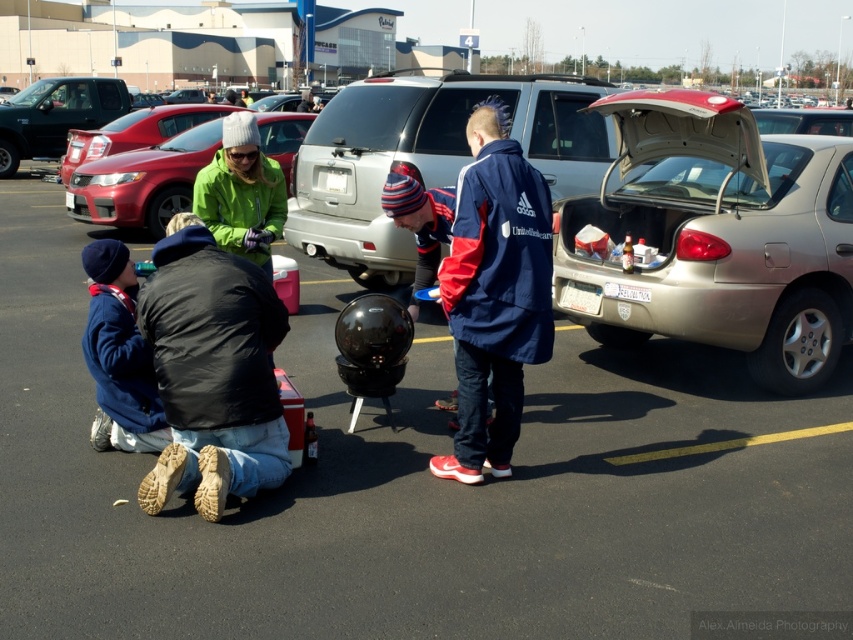
You are a photographer trying to capture a candid shot of the two people sitting by the barbecue grill. You want to ensure that both the matte blue jacket at lower left and the green fleece jacket at upper center are visible in the frame. Given their positions and sizes, will you need to adjust your camera angle to include both?

The matte blue jacket at lower left is taller than the green fleece jacket at upper center. To include both in the frame, you may need to adjust your camera angle to account for the height difference between the two jackets.

You are standing at the point labeled as point (300, 102) and want to walk towards the point labeled as point (537, 337). Which direction should you face to move towards your destination?

You should face forward because point (537, 337) is in front of point (300, 102).

You are driving a car and need to park in the parking lot shown. There is a gold metallic sedan at center right and a navy blue fabric jacket at center. Which object is closer to the parking spot you want to enter?

The gold metallic sedan at center right is closer to the parking spot you want to enter because the navy blue fabric jacket at center is behind it.